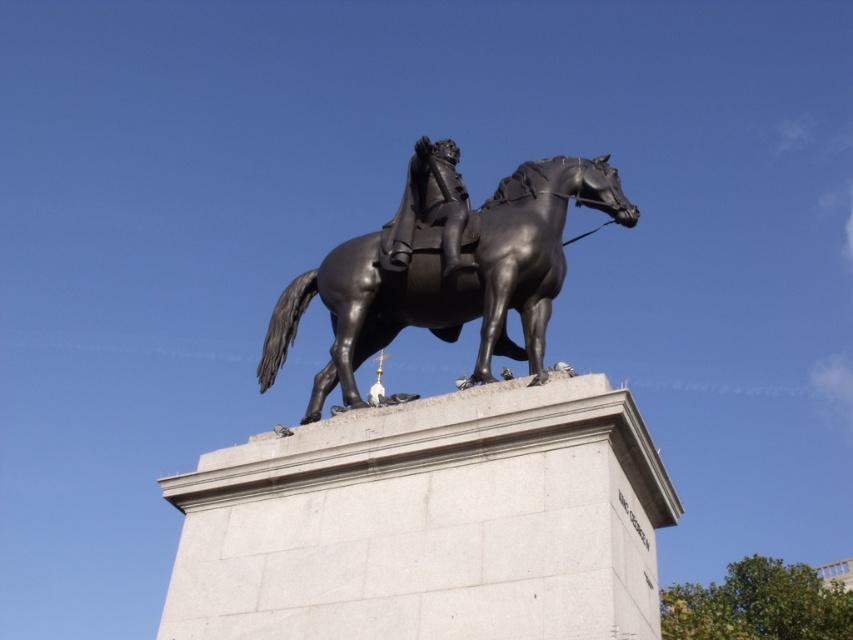
Consider the image. You are a sculptor examining the bronze equestrian statue. You notice two main components, the polished bronze horse at center and the polished bronze figure at center. Which component is positioned in front of the other?

The polished bronze horse at center is closer to the viewer than the polished bronze figure at center, so the horse is positioned in front of the figure.

Based on the photo, you are an art curator planning to display both the bronze statue at center and the polished bronze figure at center in a gallery. Given their sizes, which one should be placed in the larger exhibition space?

The bronze statue at center is bigger than the polished bronze figure at center, so it should be placed in the larger exhibition space to accommodate its size.